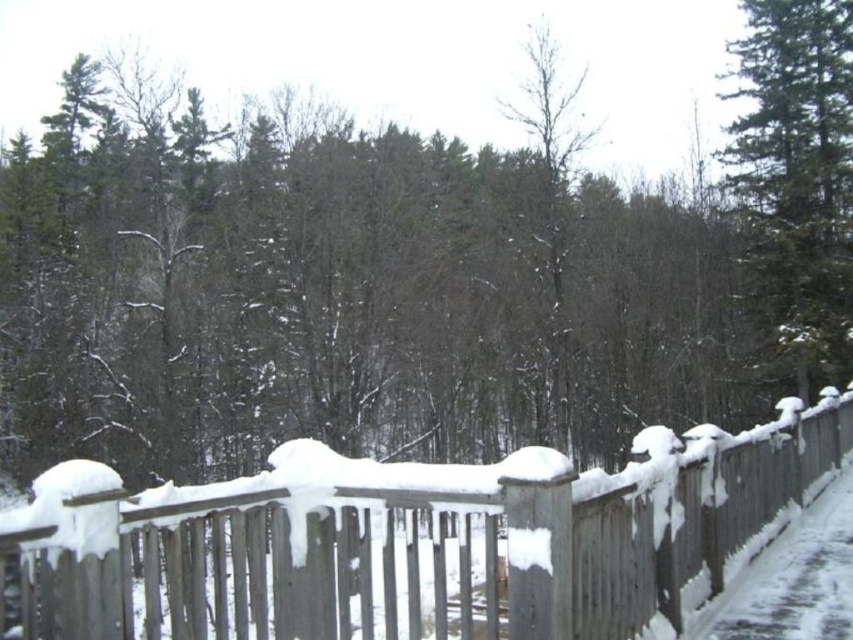
Who is more distant from viewer, [67,492] or [805,346]?

The point [805,346] is more distant.

Can you confirm if snow-covered wooden fence at center is bigger than green evergreen tree at upper right?

Yes, snow-covered wooden fence at center is bigger than green evergreen tree at upper right.

Who is more distant from viewer, (361, 609) or (802, 301)?

Positioned behind is point (802, 301).

I want to click on snow-covered wooden fence at center, so click(x=415, y=540).